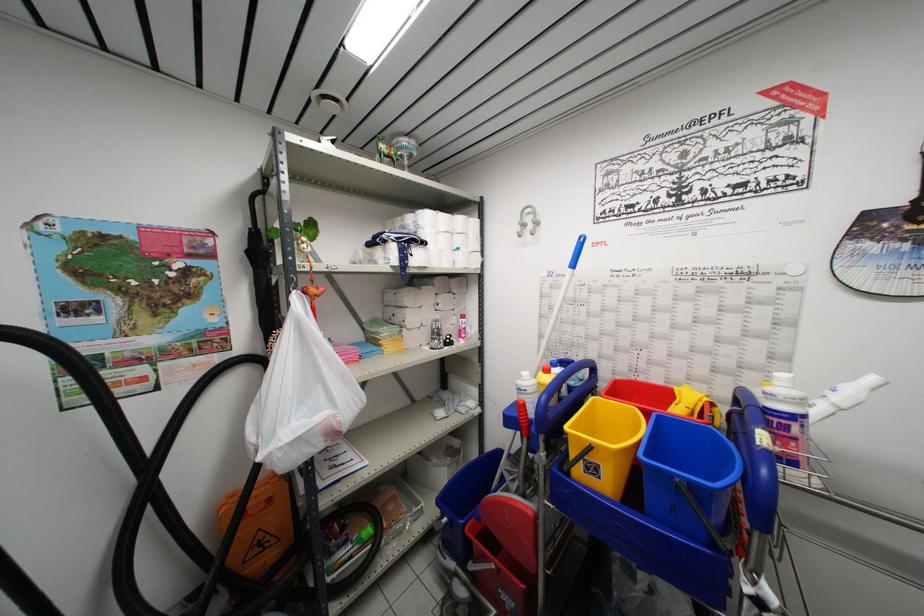
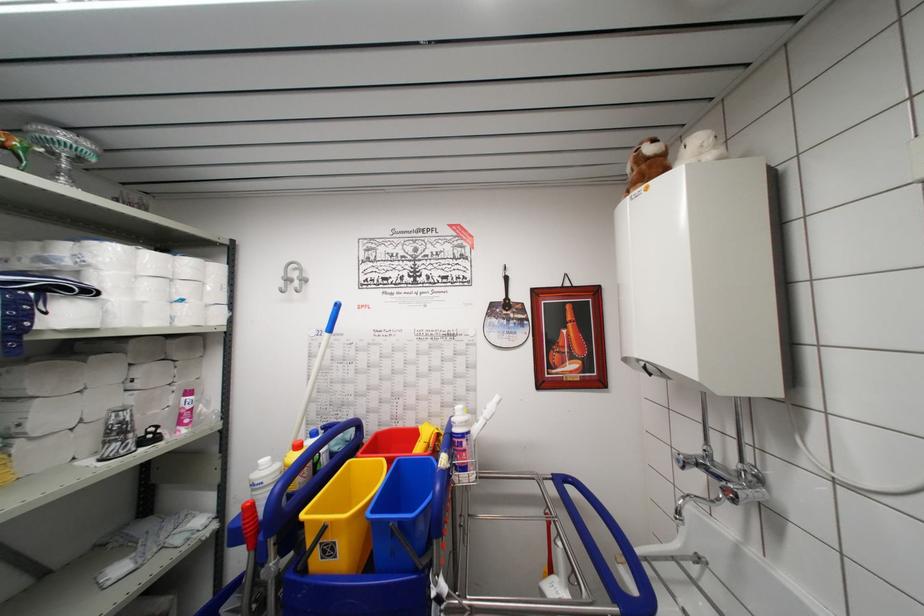
Where in the second image is the point corresponding to point 596,379 from the first image?

(361, 439)